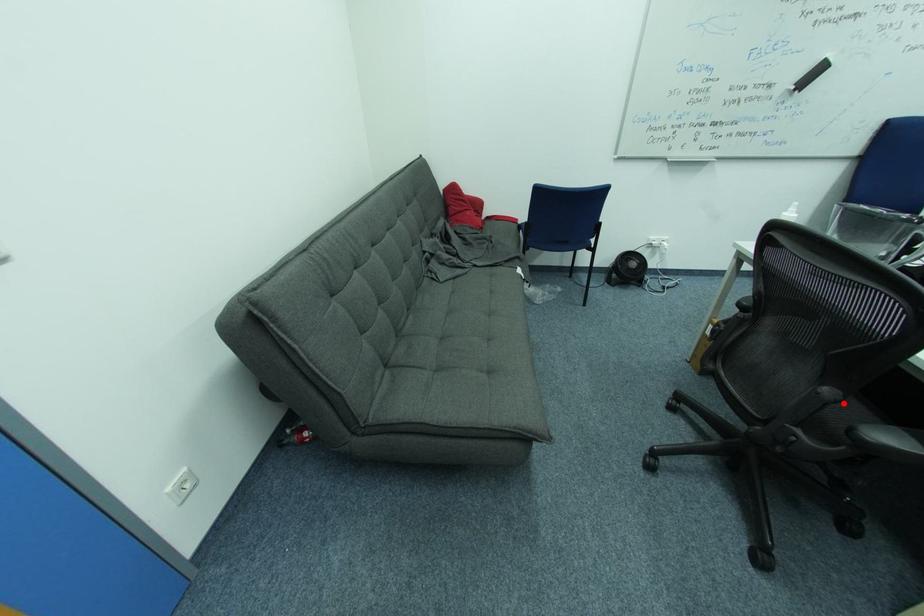
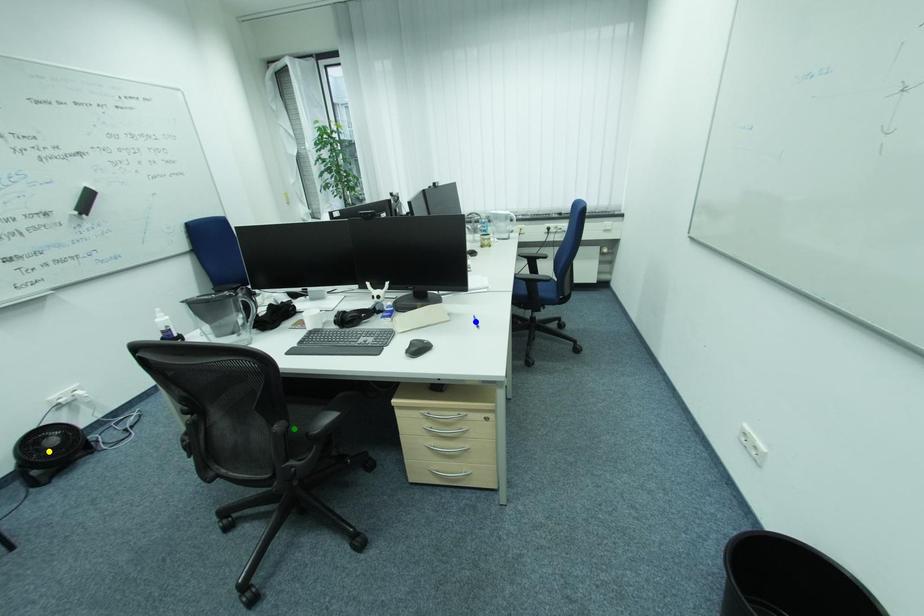
Question: I am providing you with two images of the same scene from different viewpoints. A red point is marked on the first image. You are given multiple points on the second image. Which mark in image 2 goes with the point in image 1?

Choices:
 (A) yellow point
 (B) green point
 (C) blue point

Answer: (B)